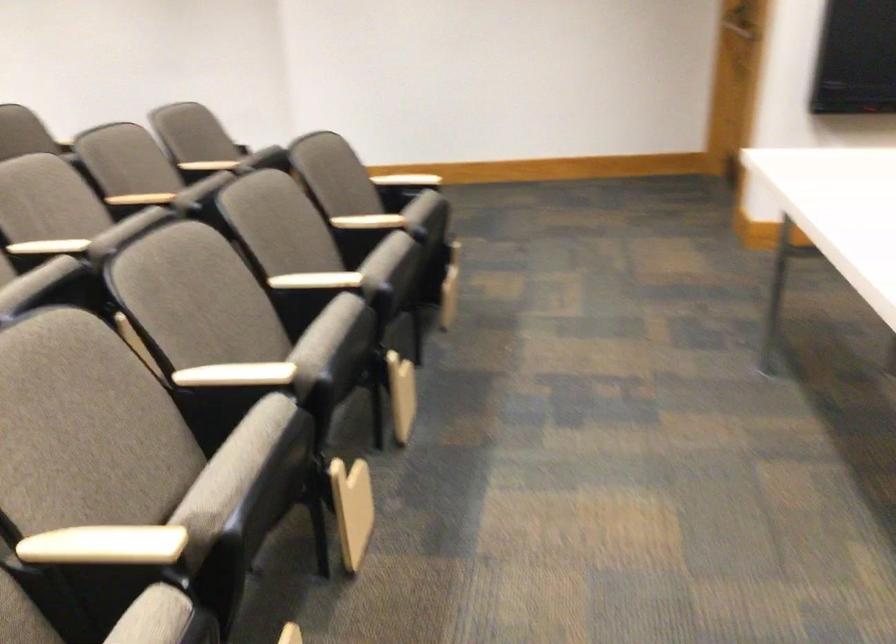
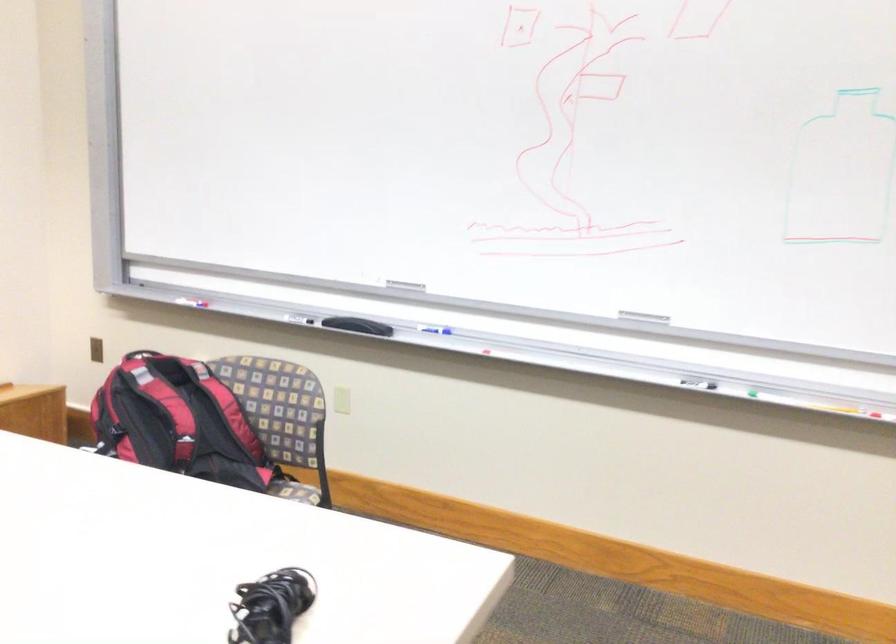
Question: Based on the continuous images, in which direction is the camera rotating? Reply with the corresponding letter.

Choices:
 (A) Left
 (B) Right
 (C) Up
 (D) Down

Answer: (B)